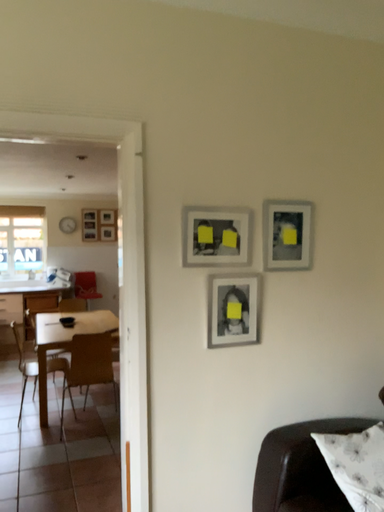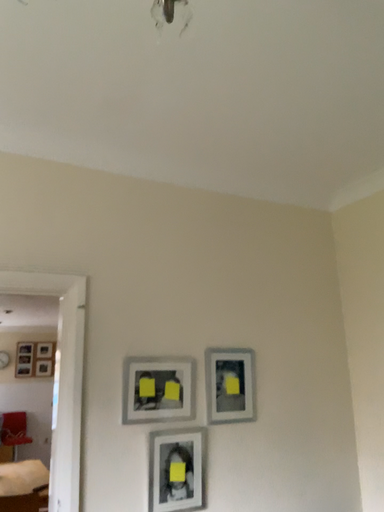
Question: Which way did the camera rotate in the video?

Choices:
 (A) rotated downward
 (B) rotated upward

Answer: (B)